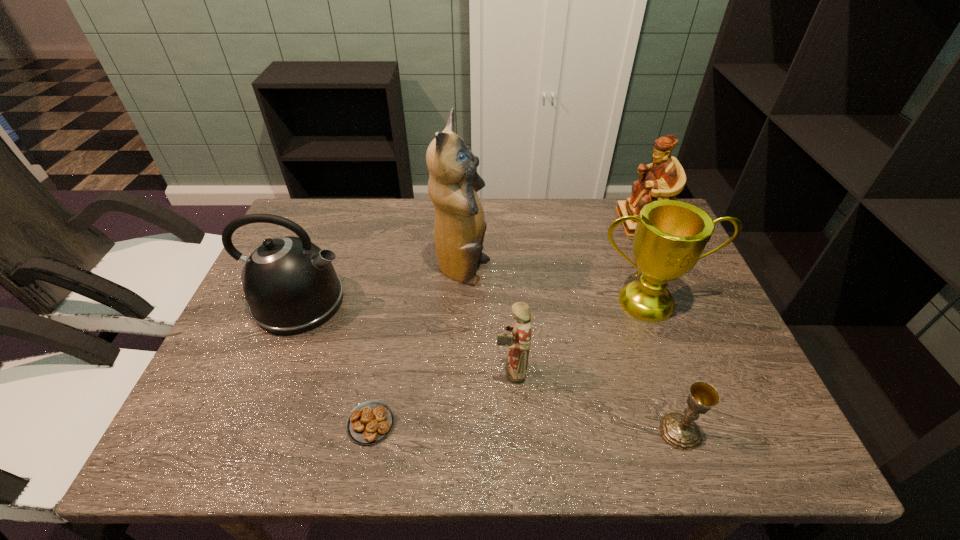
The width and height of the screenshot is (960, 540). In order to click on pastry in this screenshot , I will do `click(370, 422)`.

This screenshot has height=540, width=960. Identify the location of free point located 0.320m on the face of the fifth object from right to left. (607, 272).

Where is `vacant space located 0.280m on the front-facing side of the farther figurine`? The height and width of the screenshot is (540, 960). vacant space located 0.280m on the front-facing side of the farther figurine is located at coordinates (531, 222).

Identify the location of free space located on the front-facing side of the farther figurine. The width and height of the screenshot is (960, 540). (560, 222).

This screenshot has width=960, height=540. I want to click on free space located on the front-facing side of the farther figurine, so click(x=605, y=222).

The image size is (960, 540). I want to click on vacant space located 0.250m on the spout of the kettle, so click(x=446, y=302).

I want to click on vacant space located on the shiny surface of the award, so click(688, 410).

At what (x,y) coordinates should I click in order to perform the action: click on vacant space located on the front-facing side of the fifth farthest object. Please return your answer as a coordinate pair (x, y). Looking at the image, I should click on (428, 371).

The height and width of the screenshot is (540, 960). I want to click on vacant space located 0.350m on the front-facing side of the fifth farthest object, so click(x=338, y=371).

Image resolution: width=960 pixels, height=540 pixels. I want to click on vacant space located on the front-facing side of the fifth farthest object, so click(x=415, y=371).